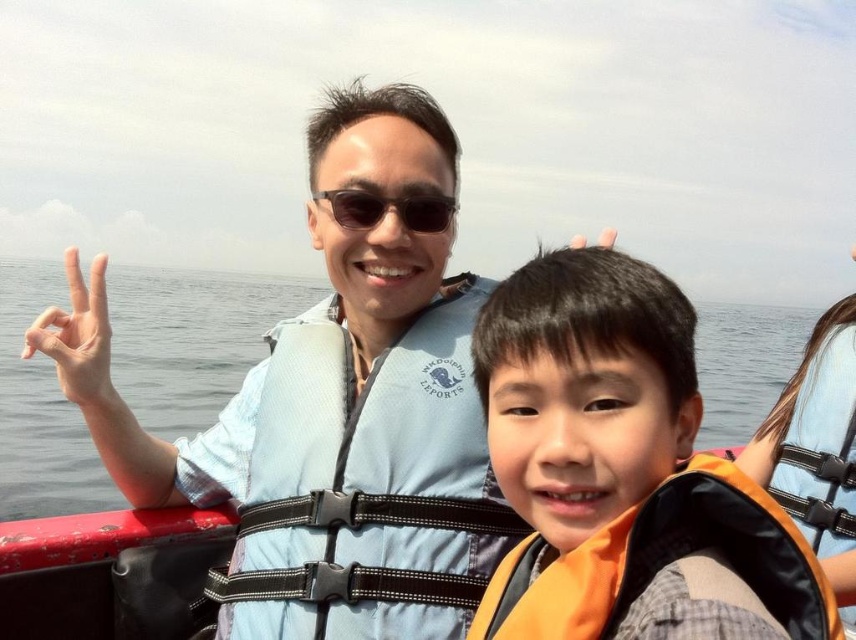
Can you confirm if blue life vest at center is positioned to the right of transparent water at center?

In fact, blue life vest at center is to the left of transparent water at center.

Who is taller, blue life vest at center or transparent water at center?

Standing taller between the two is transparent water at center.

Which is behind, point (399, 134) or point (753, 420)?

Point (753, 420)

Where is `blue life vest at center`? blue life vest at center is located at coordinates 349,417.

Locate an element on the screen. Image resolution: width=856 pixels, height=640 pixels. blue life vest at center is located at coordinates (349, 417).

Does blue life vest at center have a larger size compared to blue mesh life jacket at center?

Correct, blue life vest at center is larger in size than blue mesh life jacket at center.

The height and width of the screenshot is (640, 856). What do you see at coordinates (349, 417) in the screenshot?
I see `blue life vest at center` at bounding box center [349, 417].

You are a GUI agent. You are given a task and a screenshot of the screen. Output one action in this format:
    pyautogui.click(x=<x>, y=<y>)
    Task: Click on the blue life vest at center
    
    Given the screenshot: What is the action you would take?
    pyautogui.click(x=349, y=417)

Looking at this image, who is more forward, (449, 520) or (749, 406)?

Point (449, 520)

Can you confirm if blue mesh life jacket at center is wider than transparent water at center?

No.

What are the coordinates of `blue mesh life jacket at center` in the screenshot? It's located at (366, 484).